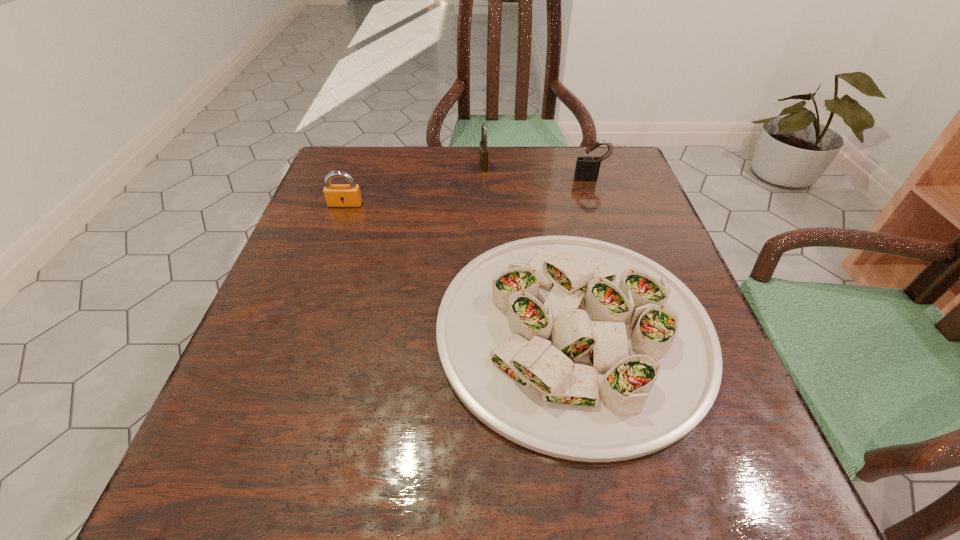
Where is `vacant point at the right edge`? vacant point at the right edge is located at coordinates (614, 200).

Where is `vacant space at the far left corner`? The width and height of the screenshot is (960, 540). vacant space at the far left corner is located at coordinates (334, 165).

Image resolution: width=960 pixels, height=540 pixels. I want to click on vacant space at the far right corner of the desktop, so click(x=623, y=158).

Find the location of `vacant space at the near right corner of the desktop`. vacant space at the near right corner of the desktop is located at coordinates (774, 489).

Locate an element on the screen. The height and width of the screenshot is (540, 960). vacant space that's between the nearest padlock and the platter is located at coordinates (459, 267).

Find the location of a particular element. The image size is (960, 540). blank region between the third nearest object and the leftmost object is located at coordinates (468, 191).

This screenshot has height=540, width=960. I want to click on vacant point located between the nearest padlock and the nearest object, so click(x=459, y=267).

Where is `empty space between the second farthest padlock and the nearest padlock`? The image size is (960, 540). empty space between the second farthest padlock and the nearest padlock is located at coordinates (468, 191).

The width and height of the screenshot is (960, 540). Identify the location of free point between the rightmost padlock and the shortest padlock. (468, 191).

You are a GUI agent. You are given a task and a screenshot of the screen. Output one action in this format:
    pyautogui.click(x=<x>, y=<y>)
    Task: Click on the object that is the closest to the second nearest object
    The height and width of the screenshot is (540, 960).
    Given the screenshot: What is the action you would take?
    pyautogui.click(x=576, y=348)